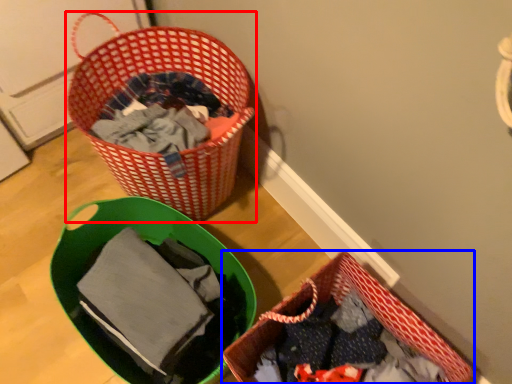
Question: Among these objects, which one is nearest to the camera, picnic basket (highlighted by a red box) or picnic basket (highlighted by a blue box)?

Choices:
 (A) picnic basket
 (B) picnic basket

Answer: (B)